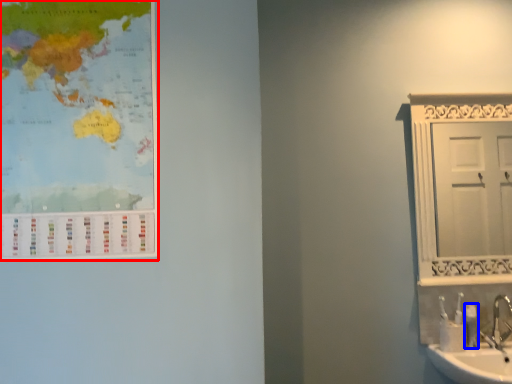
Question: Which of the following is the closest to the observer, poster (highlighted by a red box) or toiletry (highlighted by a blue box)?

Choices:
 (A) poster
 (B) toiletry

Answer: (A)